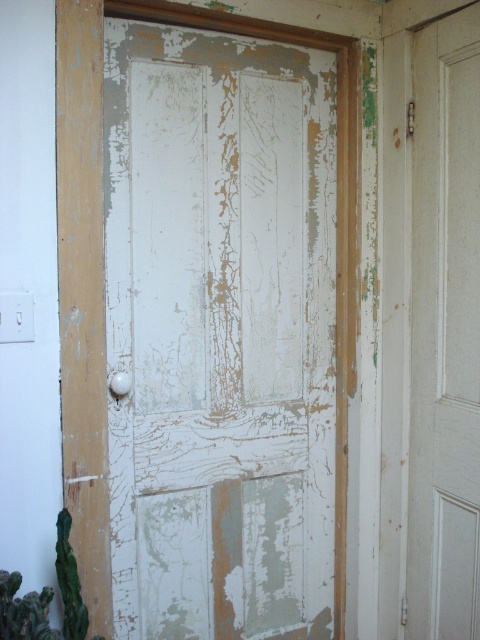
You are standing in front of the weathered wooden door. There are two points marked on the door, one at point coordinates point (217,576) and another at point coordinates point (460,502). Which point is closer to you?

Point (217,576) is further to the camera than point (460,502), so the point closer to you is point (460,502).

You are standing in front of the weathered wooden door described in the scene. There is a specific point on the door where the white peeling paint at center is located. What are the exact coordinates of this point?

The exact coordinates of the white peeling paint at center are at point (235,314).